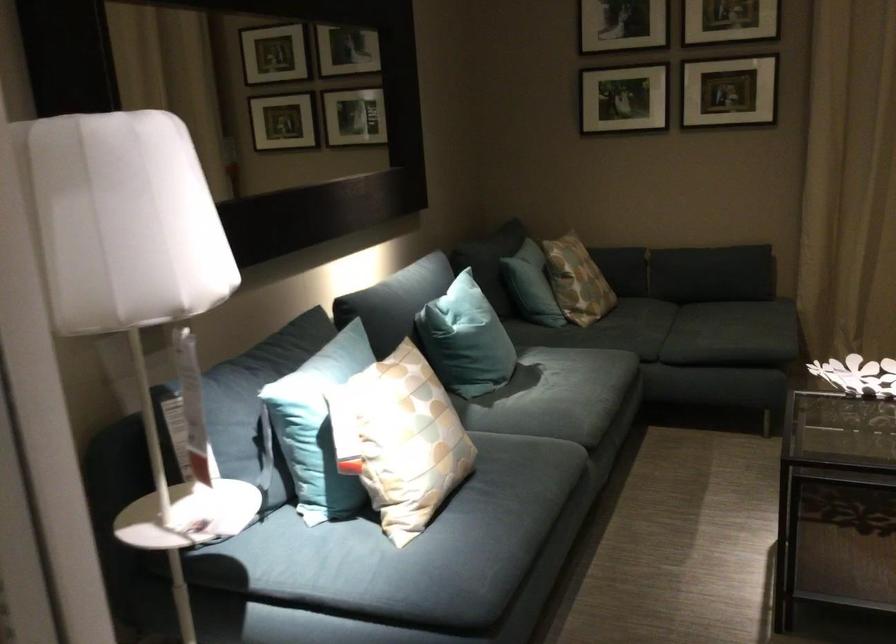
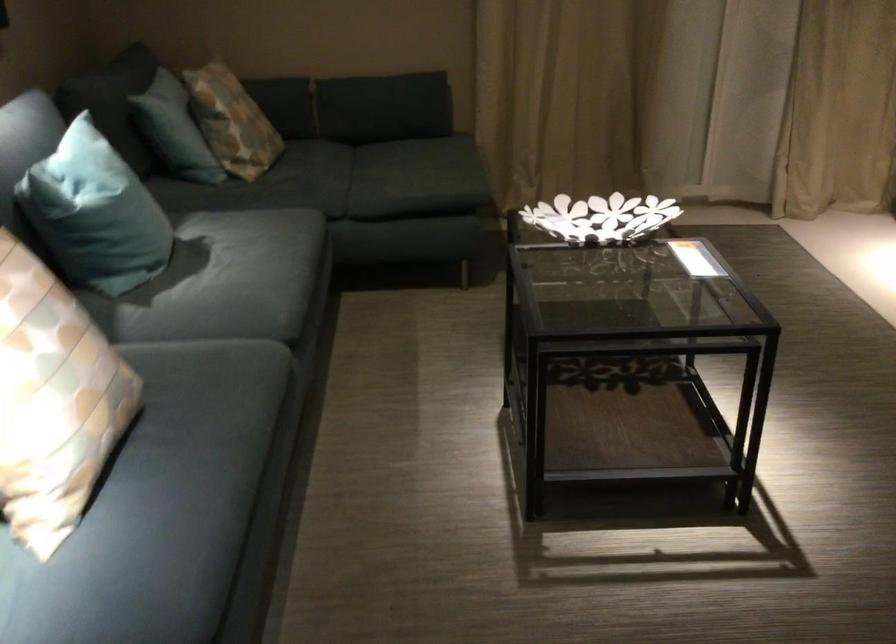
Locate, in the second image, the point that corresponds to the point at 576,267 in the first image.

(231, 120)